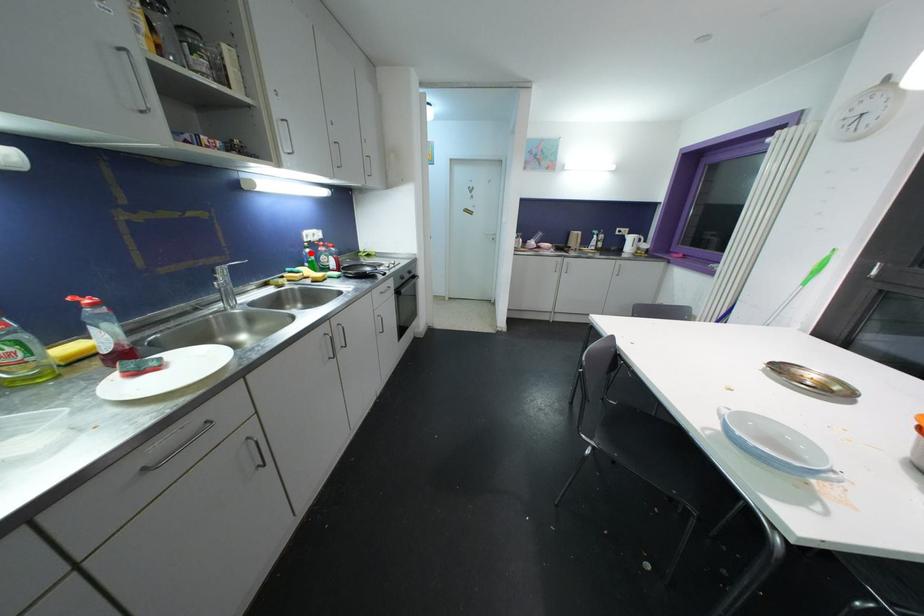
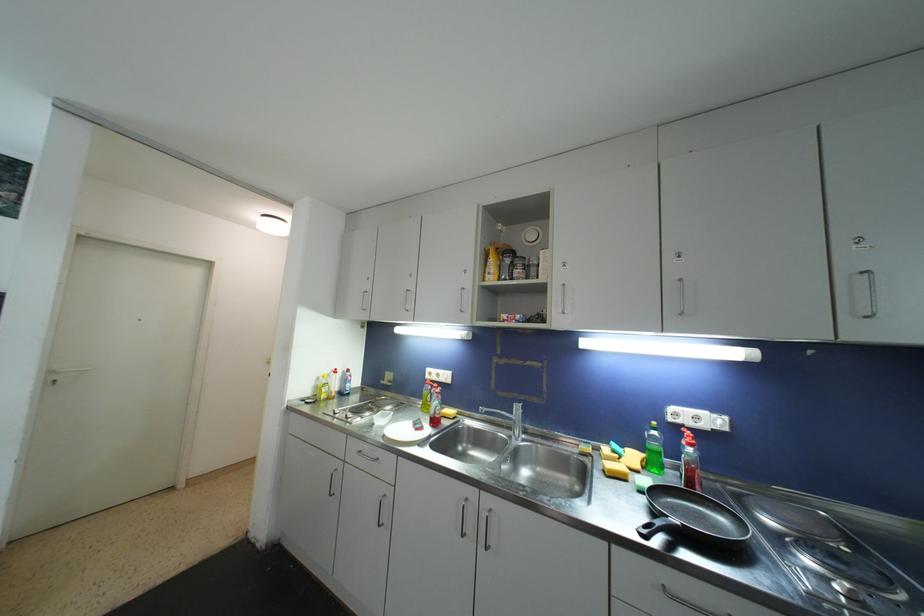
In the second image, find the point that corresponds to the highlighted location in the first image.

(658, 436)